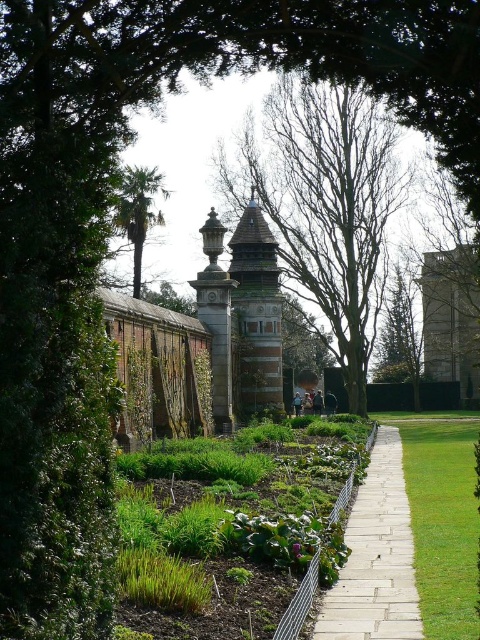
You are standing in the garden and want to walk towards the brown stone tower at center. Which direction should you go from the white stone path at center?

You should walk away from the white stone path at center towards the brown stone tower at center since the path is closer to you and the tower is further away.

You are a gardener planning to plant new flowers in the green leafy garden at center and the brown stone tower at center. Which area requires more space for planting?

The brown stone tower at center requires more space for planting because it is larger than the green leafy garden at center.

You are a gardener planning to plant a new flower bed between the bare wood tree at center and the brown stone tower at center. Based on their positions, which object should you consider as the starting point for the flower bed to ensure it is between them?

The bare wood tree at center is positioned over the brown stone tower at center, so the flower bed should start near the brown stone tower at center to be between them.